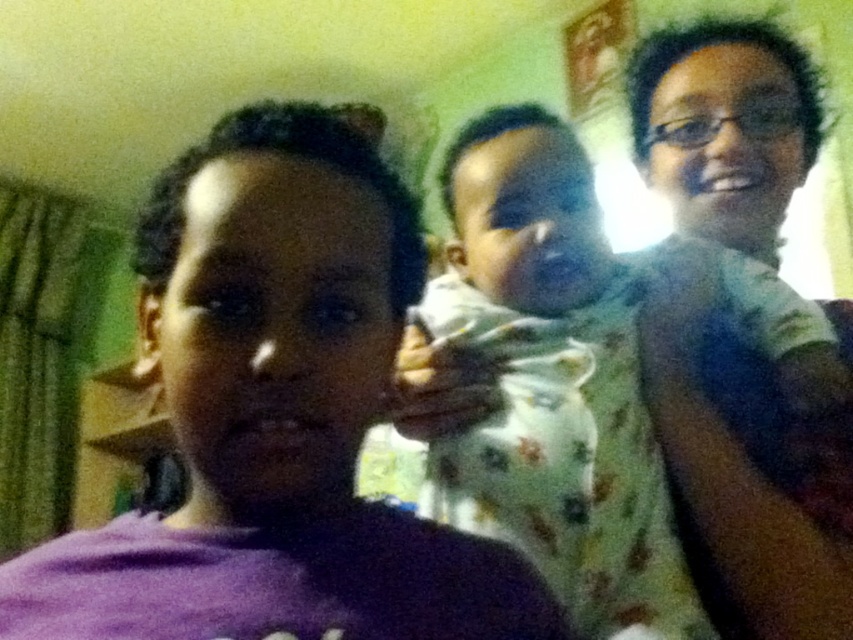
Does light green fabric baby at center have a larger size compared to matte green shirt at upper right?

Incorrect, light green fabric baby at center is not larger than matte green shirt at upper right.

Is the position of light green fabric baby at center more distant than that of matte green shirt at upper right?

No, light green fabric baby at center is closer to the viewer.

The height and width of the screenshot is (640, 853). Describe the element at coordinates (553, 392) in the screenshot. I see `light green fabric baby at center` at that location.

The width and height of the screenshot is (853, 640). I want to click on light green fabric baby at center, so click(553, 392).

This screenshot has width=853, height=640. What do you see at coordinates (274, 417) in the screenshot? I see `purple matte shirt at center` at bounding box center [274, 417].

Which is below, purple matte shirt at center or matte green shirt at upper right?

purple matte shirt at center is lower down.

I want to click on purple matte shirt at center, so 274,417.

Find the location of `purple matte shirt at center`. purple matte shirt at center is located at coordinates (274, 417).

Is the position of purple matte shirt at center less distant than that of light green fabric baby at center?

That is True.

Does purple matte shirt at center appear on the right side of light green fabric baby at center?

Incorrect, purple matte shirt at center is not on the right side of light green fabric baby at center.

You are a GUI agent. You are given a task and a screenshot of the screen. Output one action in this format:
    pyautogui.click(x=<x>, y=<y>)
    Task: Click on the purple matte shirt at center
    The height and width of the screenshot is (640, 853).
    Given the screenshot: What is the action you would take?
    pyautogui.click(x=274, y=417)

In order to click on purple matte shirt at center in this screenshot , I will do `click(274, 417)`.